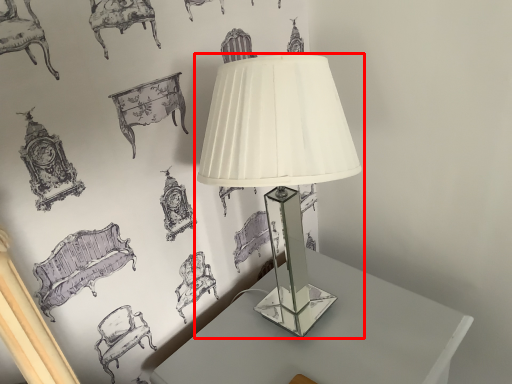
Question: Where is lamp (annotated by the red box) located in relation to table in the image?

Choices:
 (A) left
 (B) right

Answer: (A)